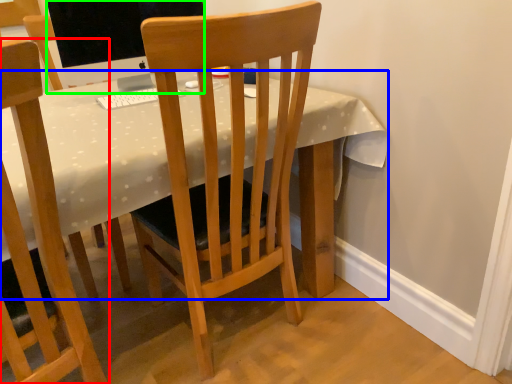
Question: Based on their relative distances, which object is farther from chair (highlighted by a red box)? Choose from desk (highlighted by a blue box) and television (highlighted by a green box).

Choices:
 (A) desk
 (B) television

Answer: (B)